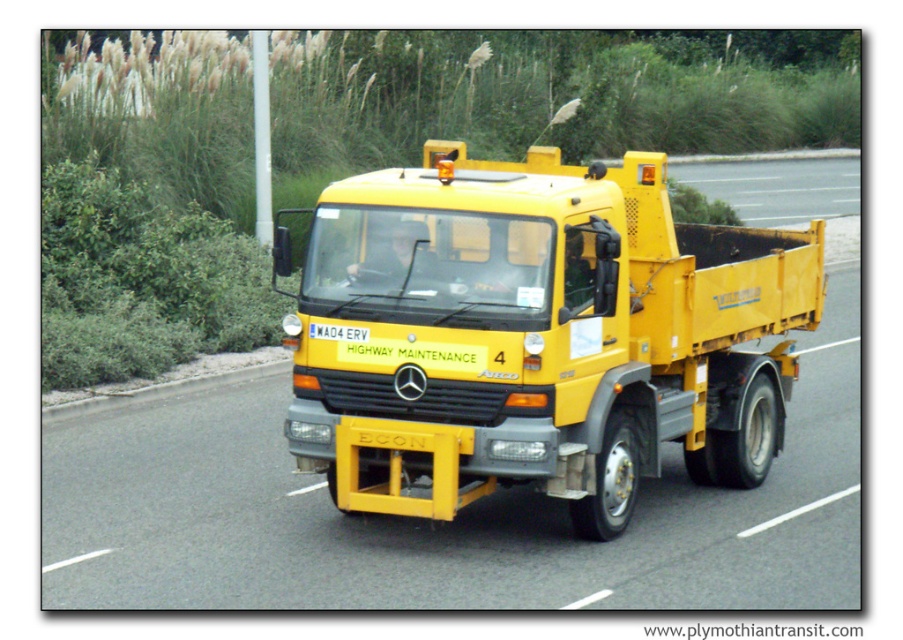
Question: Is yellow matte truck at center to the left of yellow asphalt road at center from the viewer's perspective?

Choices:
 (A) yes
 (B) no

Answer: (A)

Question: Can you confirm if yellow matte truck at center is positioned below yellow asphalt road at center?

Choices:
 (A) no
 (B) yes

Answer: (B)

Question: Which point is farther to the camera?

Choices:
 (A) click(x=506, y=451)
 (B) click(x=703, y=180)

Answer: (B)

Question: Considering the relative positions of yellow matte truck at center and yellow asphalt road at center in the image provided, where is yellow matte truck at center located with respect to yellow asphalt road at center?

Choices:
 (A) below
 (B) above

Answer: (A)

Question: Among these objects, which one is nearest to the camera?

Choices:
 (A) yellow asphalt road at center
 (B) yellow matte truck at center

Answer: (B)